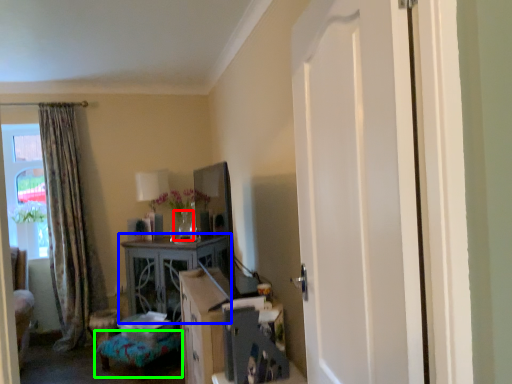
Question: Which object is positioned farthest from vase (highlighted by a red box)? Select from table (highlighted by a blue box) and furniture (highlighted by a green box).

Choices:
 (A) table
 (B) furniture

Answer: (B)